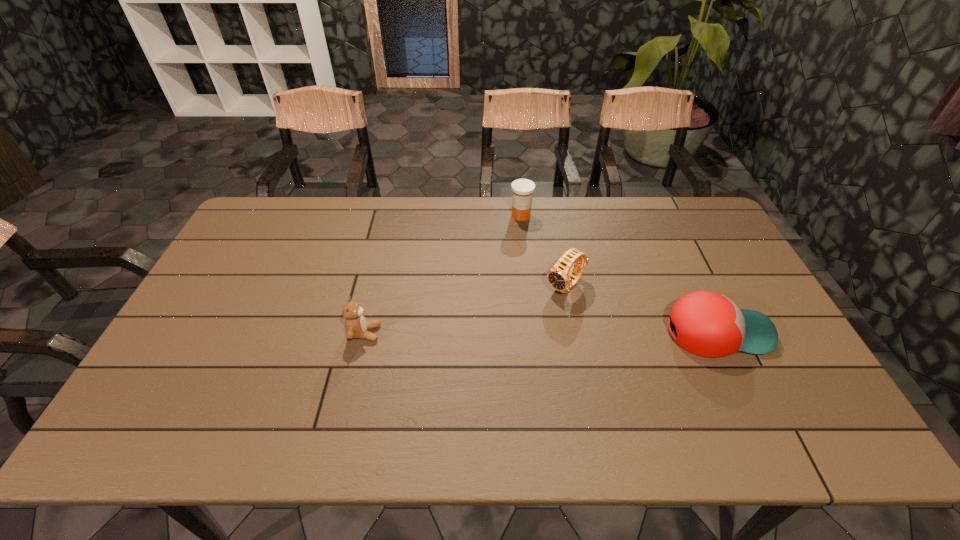
Locate an element on the screen. Image resolution: width=960 pixels, height=540 pixels. vacant point located between the leftmost object and the farthest object is located at coordinates (443, 274).

This screenshot has height=540, width=960. In order to click on object that is the closest one to the second object from left to right in this screenshot , I will do `click(559, 277)`.

Identify which object is located as the second nearest to the second object from right to left. Please provide its 2D coordinates. Your answer should be formatted as a tuple, i.e. [(x, y)], where the tuple contains the x and y coordinates of a point satisfying the conditions above.

[(523, 189)]

You are a GUI agent. You are given a task and a screenshot of the screen. Output one action in this format:
    pyautogui.click(x=<x>, y=<y>)
    Task: Click on the free spot that satisfies the following two spatial constraints: 1. on the front side of the watch; 2. at the brim of the baseball cap
    
    Given the screenshot: What is the action you would take?
    pyautogui.click(x=574, y=332)

At what (x,y) coordinates should I click in order to perform the action: click on vacant space that satisfies the following two spatial constraints: 1. on the front side of the medicine; 2. at the brim of the rightmost object. Please return your answer as a coordinate pair (x, y). Image resolution: width=960 pixels, height=540 pixels. Looking at the image, I should click on (534, 332).

Where is `vacant area in the image that satisfies the following two spatial constraints: 1. on the front side of the second object from right to left; 2. at the brim of the baseball cap`? The width and height of the screenshot is (960, 540). vacant area in the image that satisfies the following two spatial constraints: 1. on the front side of the second object from right to left; 2. at the brim of the baseball cap is located at coordinates (574, 332).